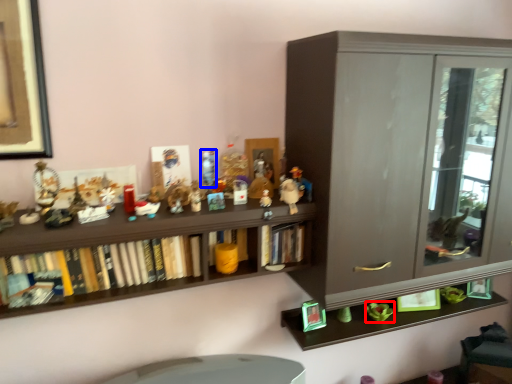
Question: Which object appears farthest to the camera in this image, toy (highlighted by a red box) or toy (highlighted by a blue box)?

Choices:
 (A) toy
 (B) toy

Answer: (A)